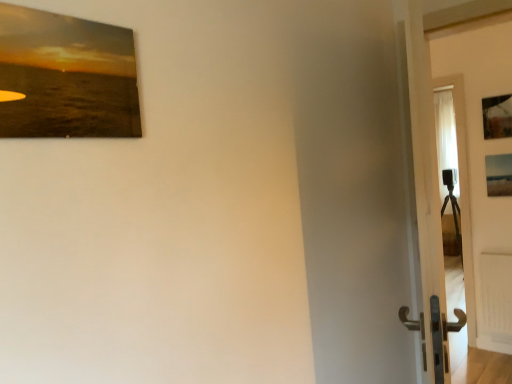
Question: Can you confirm if matte wooden picture frame at upper left, the second picture frame ordered from the bottom, is thinner than matte wooden picture frame at right, the 3th picture frame when ordered from top to bottom?

Choices:
 (A) yes
 (B) no

Answer: (A)

Question: Does matte wooden picture frame at upper left, which is the 1th picture frame from front to back, contain matte wooden picture frame at right, the 3th picture frame when ordered from top to bottom?

Choices:
 (A) yes
 (B) no

Answer: (B)

Question: Is matte wooden picture frame at upper left, the 1th picture frame positioned from the left, taller than matte wooden picture frame at right, which is counted as the 1th picture frame, starting from the right?

Choices:
 (A) yes
 (B) no

Answer: (B)

Question: From a real-world perspective, is matte wooden picture frame at upper left, the second picture frame ordered from the bottom, on top of matte wooden picture frame at right, positioned as the third picture frame in front-to-back order?

Choices:
 (A) yes
 (B) no

Answer: (A)

Question: Is matte wooden picture frame at upper left, the second picture frame ordered from the bottom, to the left of matte wooden picture frame at right, which appears as the 1th picture frame when ordered from the bottom, from the viewer's perspective?

Choices:
 (A) yes
 (B) no

Answer: (A)

Question: Are matte wooden picture frame at upper left, which is the 1th picture frame from front to back, and matte wooden picture frame at right, positioned as the 1th picture frame in back-to-front order, far apart?

Choices:
 (A) no
 (B) yes

Answer: (B)

Question: Can you confirm if white glossy door at right is bigger than matte wooden picture frame at right, the 3th picture frame when ordered from top to bottom?

Choices:
 (A) no
 (B) yes

Answer: (B)

Question: Is white glossy door at right not inside matte wooden picture frame at right, which appears as the 1th picture frame when ordered from the bottom?

Choices:
 (A) no
 (B) yes

Answer: (B)

Question: Is white glossy door at right at the left side of matte wooden picture frame at right, the 3th picture frame when ordered from top to bottom?

Choices:
 (A) yes
 (B) no

Answer: (A)

Question: Considering the relative sizes of white glossy door at right and matte wooden picture frame at right, positioned as the 1th picture frame in back-to-front order, in the image provided, is white glossy door at right thinner than matte wooden picture frame at right, positioned as the 1th picture frame in back-to-front order,?

Choices:
 (A) yes
 (B) no

Answer: (B)

Question: Is white glossy door at right wider than matte wooden picture frame at right, positioned as the third picture frame in front-to-back order?

Choices:
 (A) yes
 (B) no

Answer: (A)

Question: Can you confirm if white glossy door at right is smaller than matte wooden picture frame at right, the 3th picture frame when ordered from top to bottom?

Choices:
 (A) no
 (B) yes

Answer: (A)

Question: Is wooden frame at upper right, which appears as the 2th picture frame when viewed from the back, not inside white glossy door at right?

Choices:
 (A) yes
 (B) no

Answer: (A)